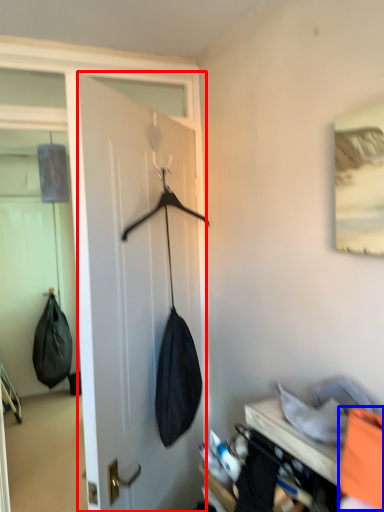
Question: Which of the following is the farthest to the observer, door (highlighted by a red box) or clothing (highlighted by a blue box)?

Choices:
 (A) door
 (B) clothing

Answer: (A)